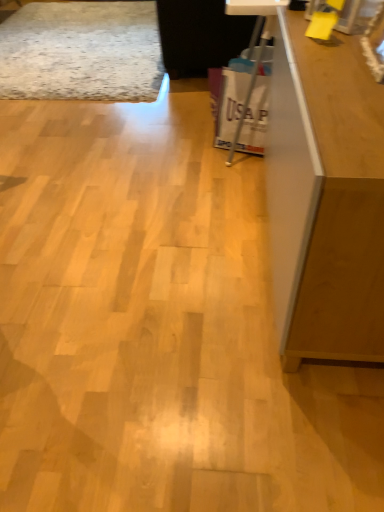
Question: Is white plastic bag at center positioned with its back to wooden counter top at upper right?

Choices:
 (A) yes
 (B) no

Answer: (A)

Question: Is white plastic bag at center not inside wooden counter top at upper right?

Choices:
 (A) no
 (B) yes

Answer: (A)

Question: Considering the relative sizes of white plastic bag at center and wooden counter top at upper right in the image provided, is white plastic bag at center taller than wooden counter top at upper right?

Choices:
 (A) no
 (B) yes

Answer: (A)

Question: Does white plastic bag at center have a lesser width compared to wooden counter top at upper right?

Choices:
 (A) no
 (B) yes

Answer: (B)

Question: Is white plastic bag at center facing towards wooden counter top at upper right?

Choices:
 (A) no
 (B) yes

Answer: (B)

Question: Considering the relative sizes of white plastic bag at center and wooden counter top at upper right in the image provided, is white plastic bag at center wider than wooden counter top at upper right?

Choices:
 (A) yes
 (B) no

Answer: (B)

Question: Is matte brown cabinet at right facing away from white plastic bag at center?

Choices:
 (A) yes
 (B) no

Answer: (B)

Question: Is matte brown cabinet at right aimed at white plastic bag at center?

Choices:
 (A) no
 (B) yes

Answer: (A)

Question: Considering the relative sizes of matte brown cabinet at right and white plastic bag at center in the image provided, is matte brown cabinet at right smaller than white plastic bag at center?

Choices:
 (A) yes
 (B) no

Answer: (B)

Question: Is matte brown cabinet at right taller than white plastic bag at center?

Choices:
 (A) yes
 (B) no

Answer: (A)

Question: Is matte brown cabinet at right shorter than white plastic bag at center?

Choices:
 (A) yes
 (B) no

Answer: (B)

Question: Can white plastic bag at center be found inside matte brown cabinet at right?

Choices:
 (A) no
 (B) yes

Answer: (A)

Question: Considering the relative sizes of matte brown cabinet at right and wooden counter top at upper right in the image provided, is matte brown cabinet at right shorter than wooden counter top at upper right?

Choices:
 (A) no
 (B) yes

Answer: (B)